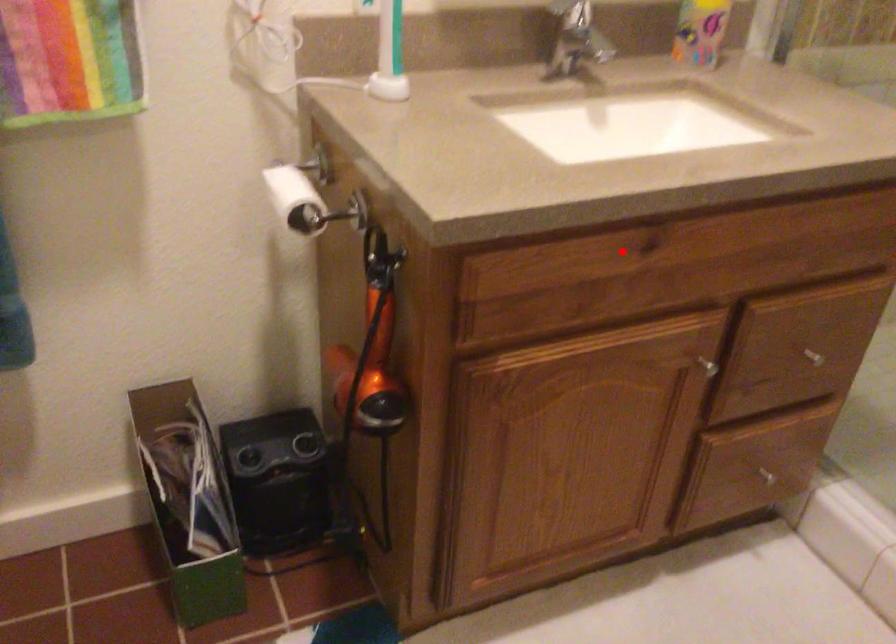
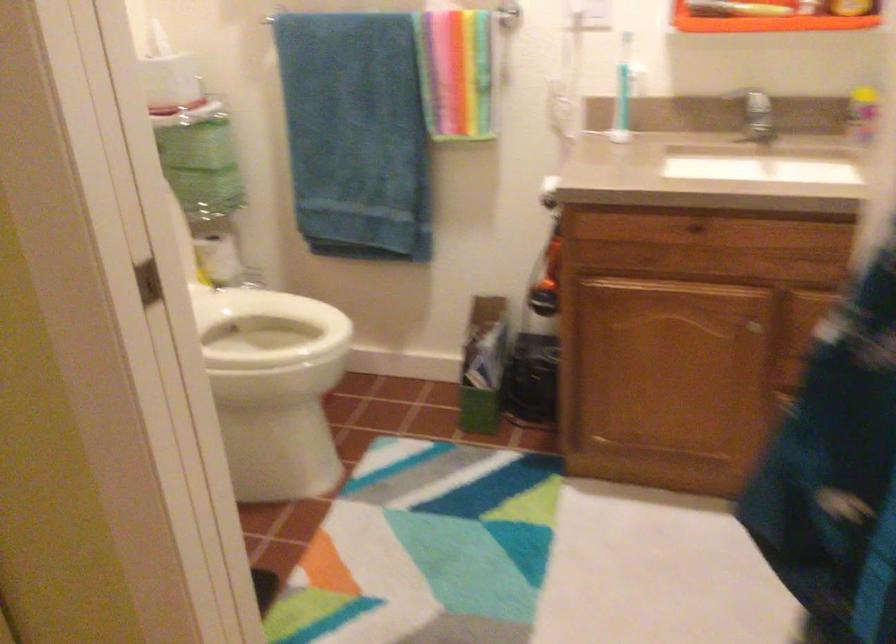
Question: I am providing you with two images of the same scene from different viewpoints. A red point is shown in image1. For the corresponding object point in image2, is it positioned nearer or farther from the camera?

Choices:
 (A) Nearer
 (B) Farther

Answer: (B)